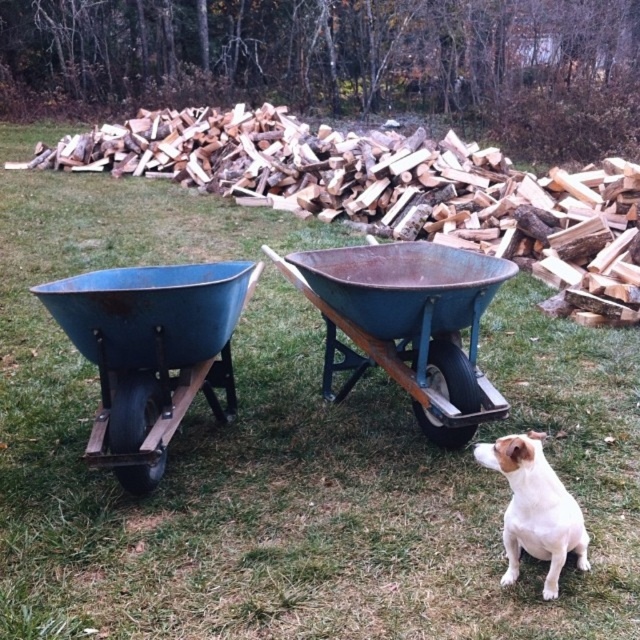
Question: Which is farther from the rustic metal wheelbarrow at center?

Choices:
 (A) white fur dog at lower right
 (B) rusty metal wheelbarrow at center

Answer: (A)

Question: Is rustic metal wheelbarrow at center wider than rusty metal wheelbarrow at center?

Choices:
 (A) no
 (B) yes

Answer: (B)

Question: Estimate the real-world distances between objects in this image. Which object is farther from the white fur dog at lower right?

Choices:
 (A) blue metal wheelbarrow at left
 (B) rustic metal wheelbarrow at center
 (C) rusty metal wheelbarrow at center

Answer: (B)

Question: Can you confirm if rusty metal wheelbarrow at center is smaller than white fur dog at lower right?

Choices:
 (A) yes
 (B) no

Answer: (B)

Question: Among these points, which one is nearest to the camera?

Choices:
 (A) (182, 385)
 (B) (513, 481)

Answer: (B)

Question: Can you confirm if rustic metal wheelbarrow at center is positioned below rusty metal wheelbarrow at center?

Choices:
 (A) no
 (B) yes

Answer: (A)